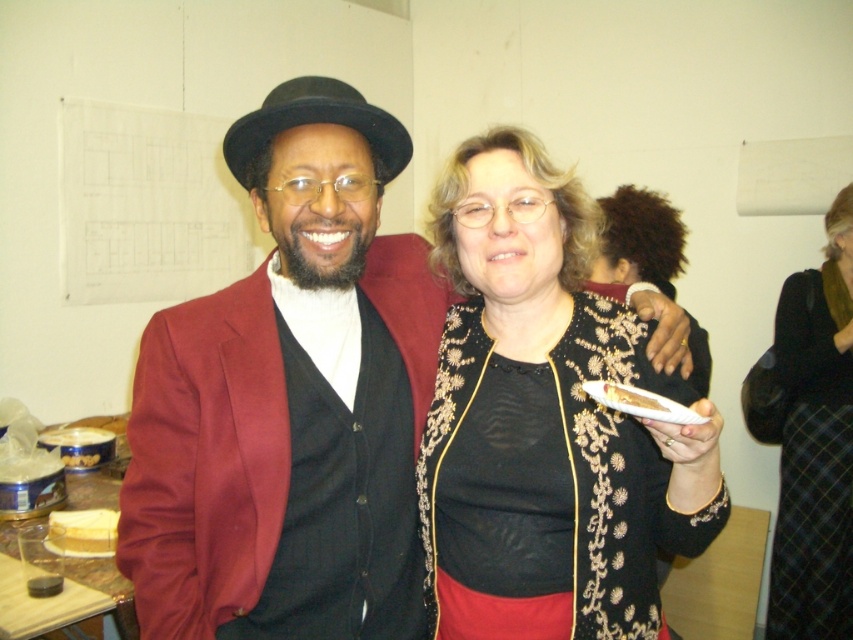
You are a photographer at the event and want to take a photo of the shiny black hat at center and the black embroidered jacket at center. Which object should you focus on first if you want to capture both in one shot without moving the camera?

The shiny black hat at center is taller than the black embroidered jacket at center, so you should focus on the shiny black hat at center first to ensure it fits within the frame.

You are at a party and want to take a photo with the black embroidered jacket at center and the black woolen skirt at lower right. To ensure both are visible in the frame, should you adjust your camera angle upwards or downwards?

The black embroidered jacket at center is above the black woolen skirt at lower right, so you should adjust your camera angle downwards to include both in the frame.